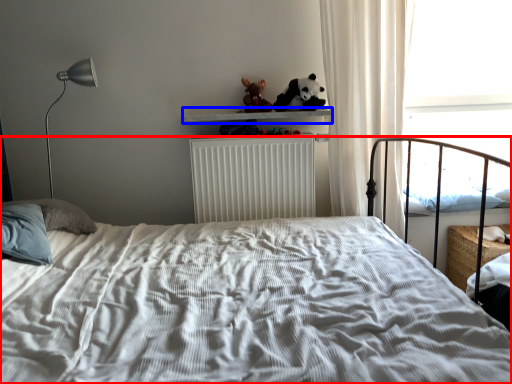
Question: Among these objects, which one is farthest to the camera, bed (highlighted by a red box) or window sill (highlighted by a blue box)?

Choices:
 (A) bed
 (B) window sill

Answer: (B)